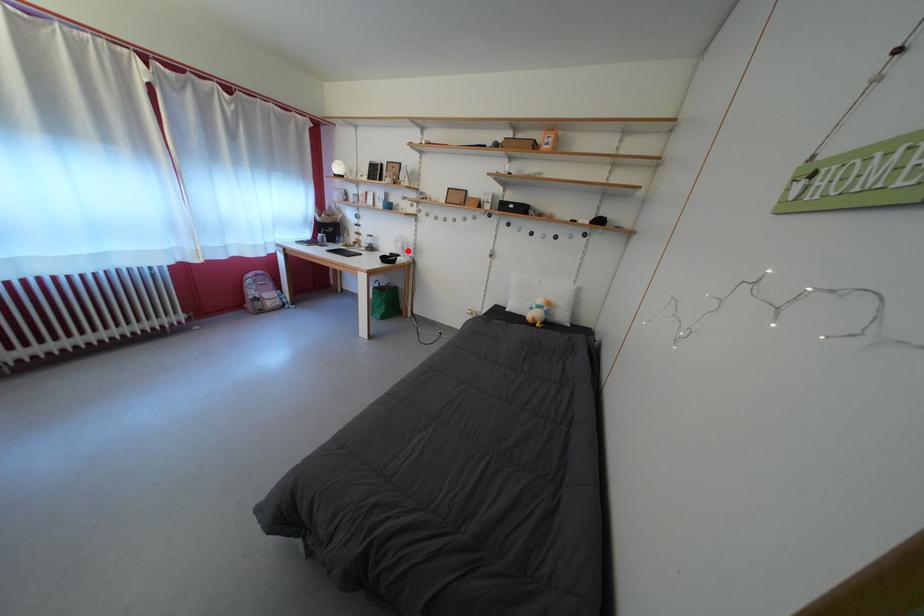
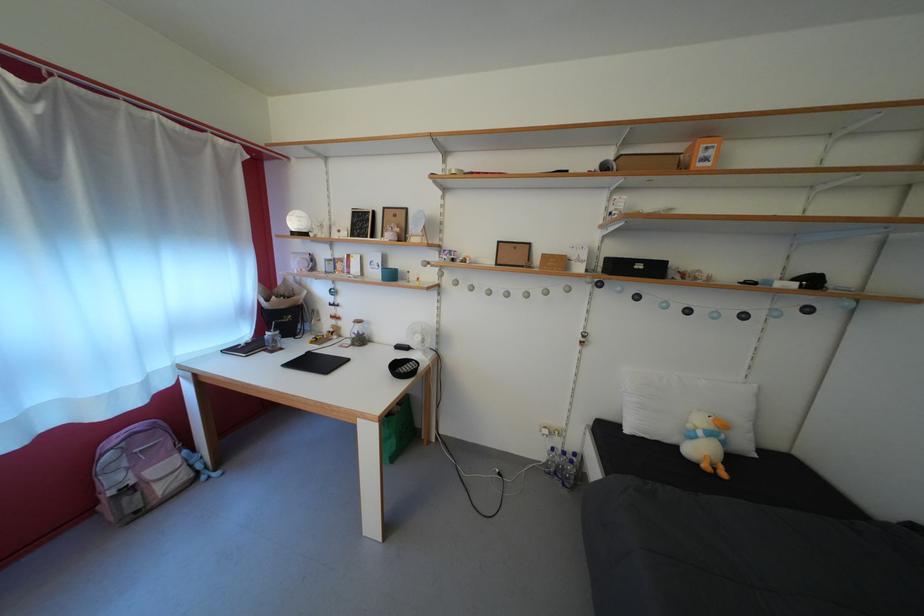
Question: I am providing you with two images of the same scene from different viewpoints. A red point is marked on the first image. At the location where the point appears in image 1, is it still visible in image 2?

Choices:
 (A) Yes
 (B) No

Answer: (A)